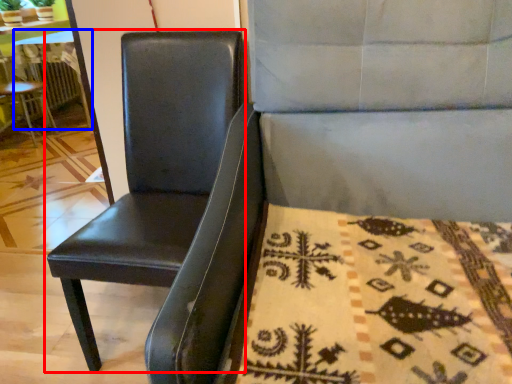
Question: Which of the following is the farthest to the observer, chair (highlighted by a red box) or table (highlighted by a blue box)?

Choices:
 (A) chair
 (B) table

Answer: (B)